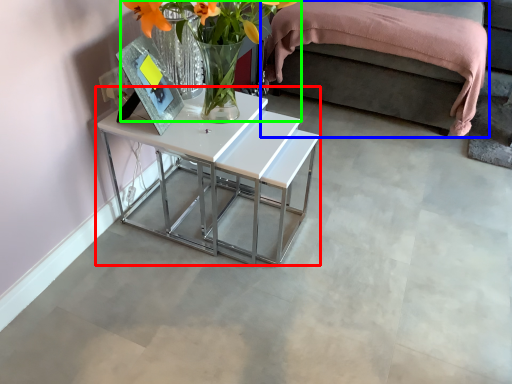
Question: Which object is positioned closest to table (highlighted by a red box)? Select from bed (highlighted by a blue box) and floral arrangement (highlighted by a green box).

Choices:
 (A) bed
 (B) floral arrangement

Answer: (B)